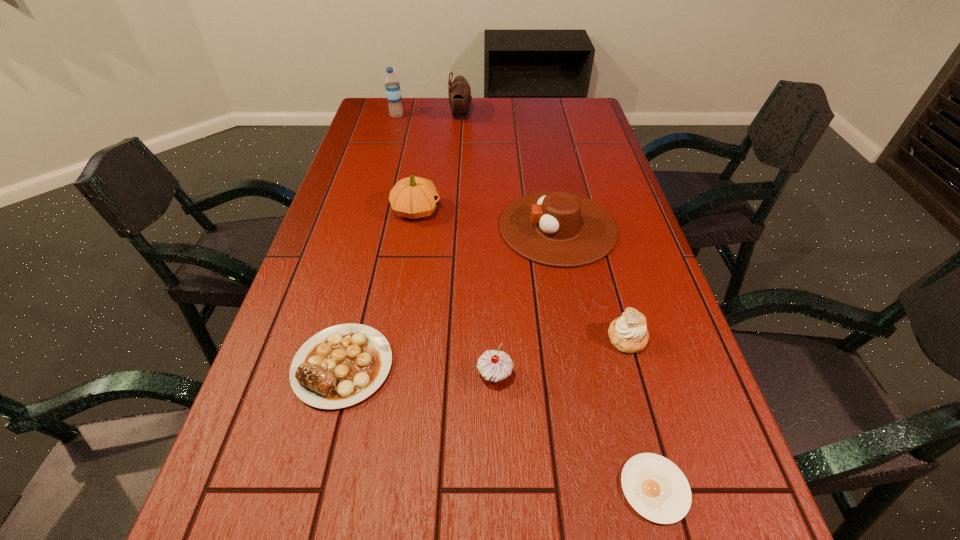
Image resolution: width=960 pixels, height=540 pixels. Find the location of `pouch located in the far edge section of the desktop`. pouch located in the far edge section of the desktop is located at coordinates (459, 92).

Identify the location of water bottle that is at the left edge. (392, 87).

This screenshot has width=960, height=540. In order to click on steak located in the left edge section of the desktop in this screenshot , I will do `click(340, 366)`.

Where is `cowboy hat present at the right edge`? cowboy hat present at the right edge is located at coordinates (555, 228).

I want to click on pastry that is at the right edge, so click(628, 333).

The width and height of the screenshot is (960, 540). I want to click on egg yolk present at the right edge, so pos(655,487).

At what (x,y) coordinates should I click in order to perform the action: click on object at the far left corner. Please return your answer as a coordinate pair (x, y). The image size is (960, 540). Looking at the image, I should click on (392, 87).

Locate an element on the screen. free space at the far edge of the desktop is located at coordinates (411, 125).

The image size is (960, 540). In order to click on vacant space at the left edge of the desktop in this screenshot , I will do `click(344, 224)`.

Locate an element on the screen. This screenshot has height=540, width=960. vacant space at the right edge of the desktop is located at coordinates (634, 207).